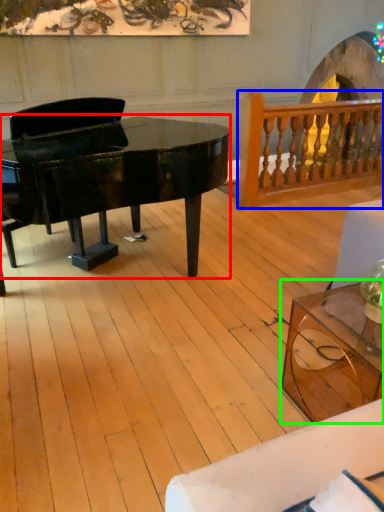
Question: Based on their relative distances, which object is farther from piano (highlighted by a red box)? Choose from rail (highlighted by a blue box) and coffee table (highlighted by a green box).

Choices:
 (A) rail
 (B) coffee table

Answer: (A)